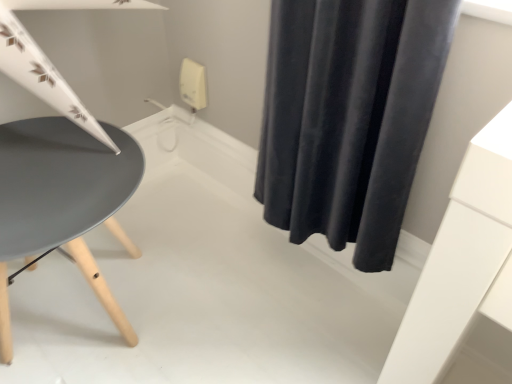
Image resolution: width=512 pixels, height=384 pixels. What do you see at coordinates (62, 199) in the screenshot? I see `matte black table at left` at bounding box center [62, 199].

Locate an element on the screen. The height and width of the screenshot is (384, 512). matte black table at left is located at coordinates (62, 199).

Identify the location of matte black table at left. [62, 199].